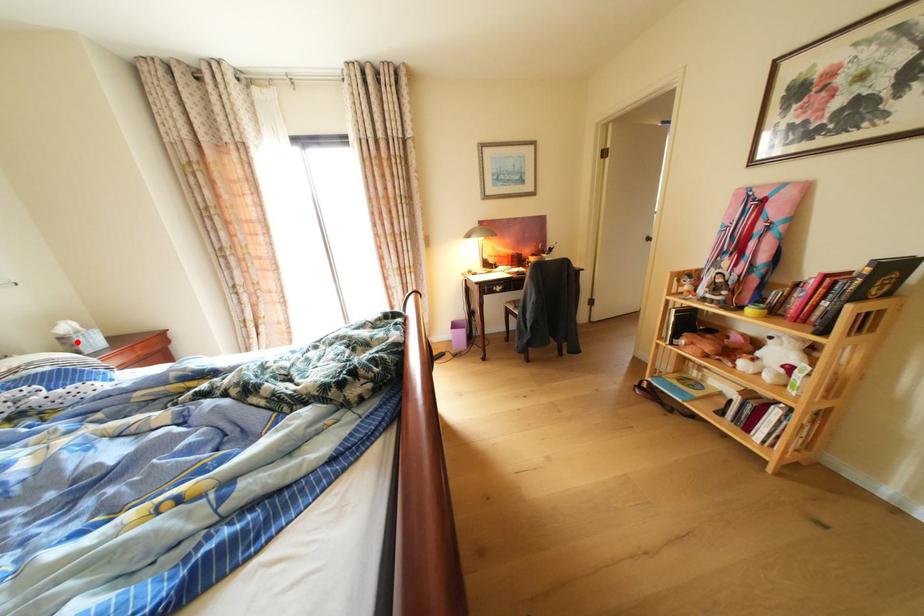
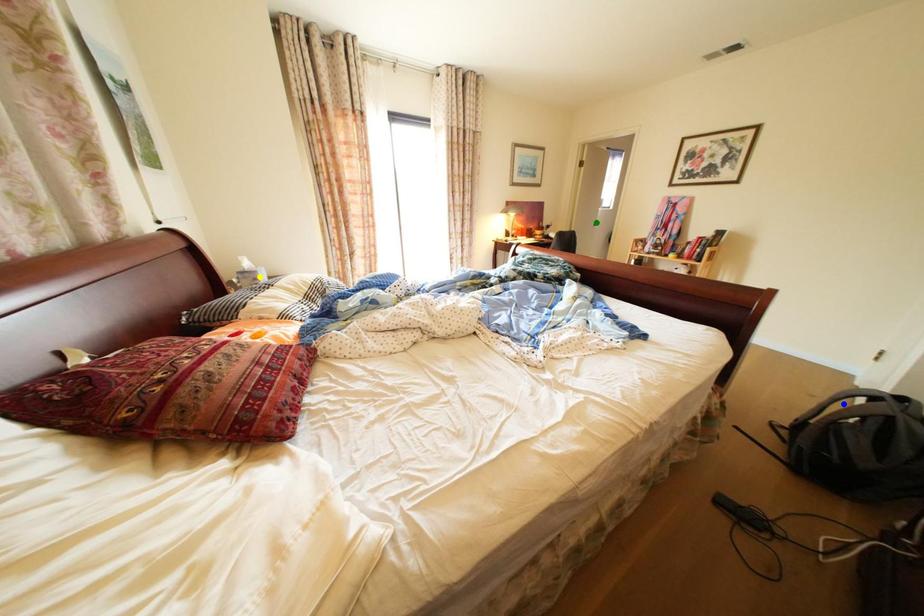
Question: I am providing you with two images of the same scene from different viewpoints. A red point is marked on the first image. You are given multiple points on the second image. Which spot in image 2 lines up with the point in image 1?

Choices:
 (A) green point
 (B) yellow point
 (C) blue point

Answer: (B)